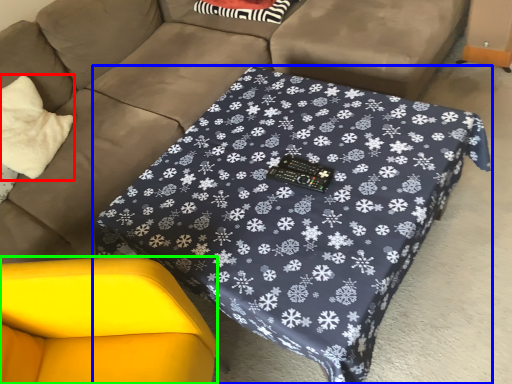
Question: Which object is the farthest from throw pillow (highlighted by a red box)? Choose among these: table (highlighted by a blue box) or swivel chair (highlighted by a green box).

Choices:
 (A) table
 (B) swivel chair

Answer: (A)